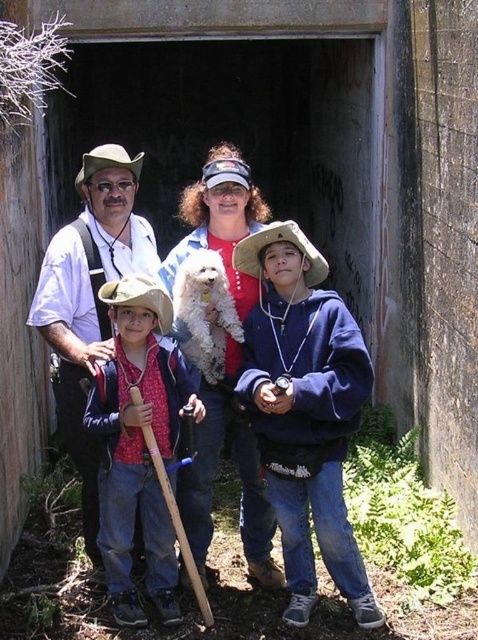
Can you confirm if matte blue jacket at center is positioned to the left of white fluffy dog at center?

Incorrect, matte blue jacket at center is not on the left side of white fluffy dog at center.

Measure the distance from matte blue jacket at center to white fluffy dog at center.

11.96 inches

This screenshot has width=478, height=640. Identify the location of matte blue jacket at center. (239, 476).

Can you confirm if matte red shirt at center is wider than white fluffy dog at center?

Correct, the width of matte red shirt at center exceeds that of white fluffy dog at center.

Does point (149, 460) come farther from viewer compared to point (239, 280)?

No, it is in front of (239, 280).

The width and height of the screenshot is (478, 640). What are the coordinates of `matte red shirt at center` in the screenshot? It's located at (141, 449).

Who is more distant from viewer, (x=184, y=520) or (x=88, y=166)?

The point (x=184, y=520) is behind.

Who is shorter, white fluffy dog at center or strawhat at center?

Standing shorter between the two is white fluffy dog at center.

What do you see at coordinates (239, 476) in the screenshot?
I see `white fluffy dog at center` at bounding box center [239, 476].

Find the location of a particular element. white fluffy dog at center is located at coordinates (239, 476).